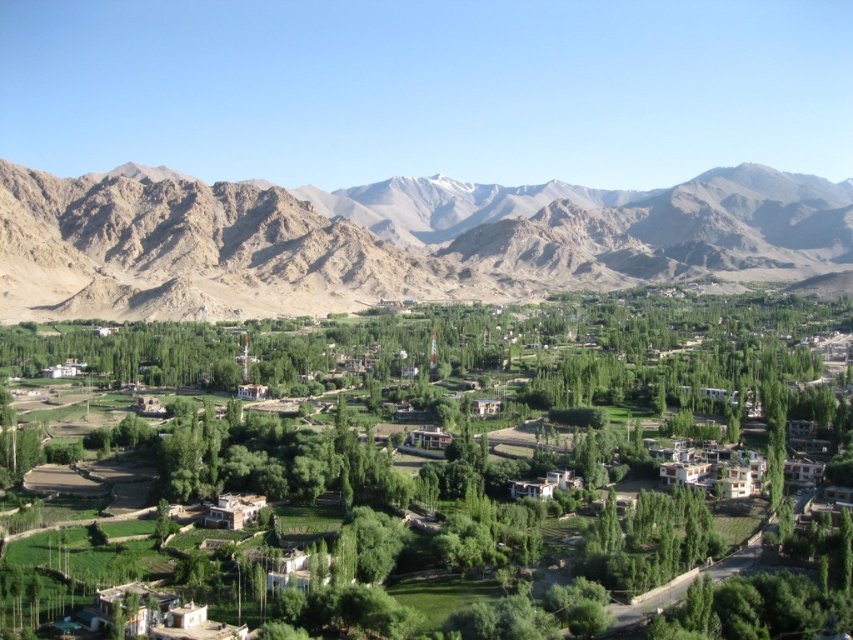
Can you confirm if green leafy tree at center is positioned to the right of rugged brown mountains at upper left?

Incorrect, green leafy tree at center is not on the right side of rugged brown mountains at upper left.

Is green leafy tree at center wider than rugged brown mountains at upper left?

No, green leafy tree at center is not wider than rugged brown mountains at upper left.

Is point (714, 396) in front of point (229, 289)?

That is True.

This screenshot has width=853, height=640. I want to click on green leafy tree at center, so click(x=518, y=394).